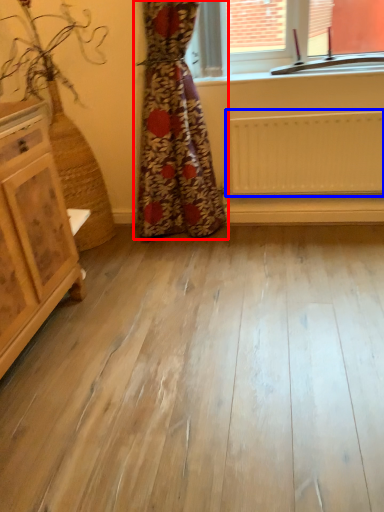
Question: Which point is closer to the camera, curtain (highlighted by a red box) or radiator (highlighted by a blue box)?

Choices:
 (A) curtain
 (B) radiator

Answer: (A)